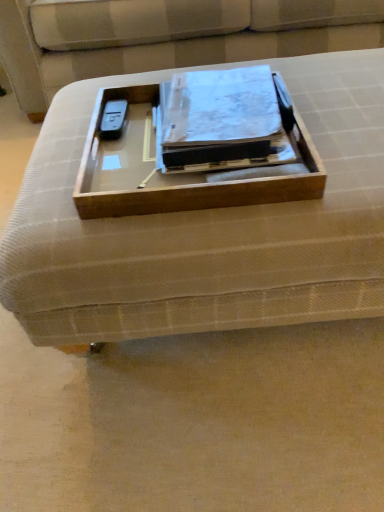
Locate an element on the screen. This screenshot has width=384, height=512. free space to the left of wooden tray at center is located at coordinates (59, 162).